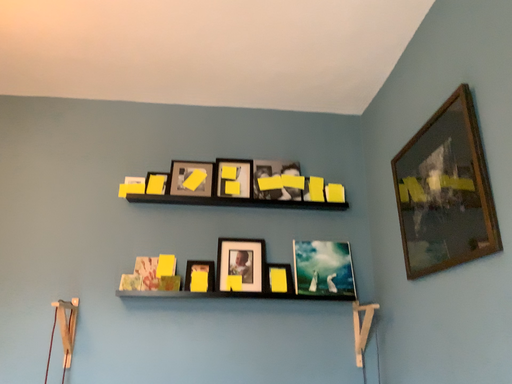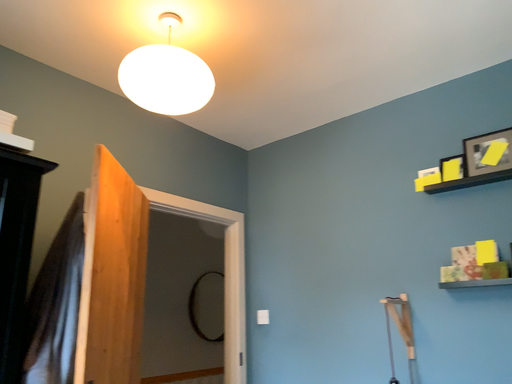
Question: Which way did the camera rotate in the video?

Choices:
 (A) rotated left
 (B) rotated right

Answer: (A)